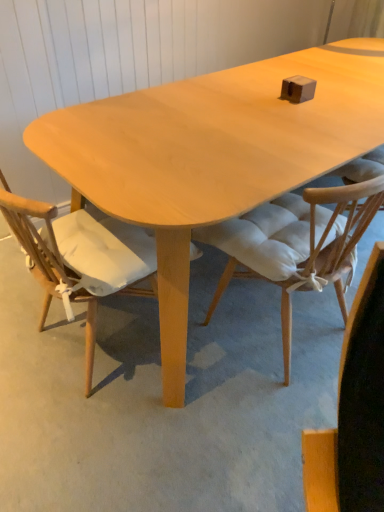
At what (x,y) coordinates should I click in order to perform the action: click on free area in between white padded chair at center, which appears as the 1th chair when viewed from the right, and light wood chair at center, which is the 2th chair in right-to-left order. Please return your answer as a coordinate pair (x, y). The height and width of the screenshot is (512, 384). Looking at the image, I should click on (195, 362).